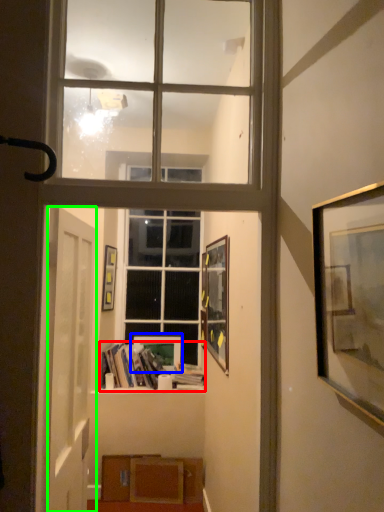
Question: Which is farther away from book (highlighted by a red box)? picture frame (highlighted by a blue box) or door (highlighted by a green box)?

Choices:
 (A) picture frame
 (B) door

Answer: (B)